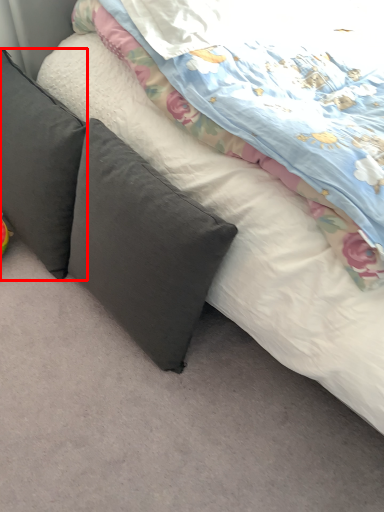
Question: From the image, what is the correct spatial relationship of pillow (annotated by the red box) in relation to pillow?

Choices:
 (A) left
 (B) right

Answer: (A)